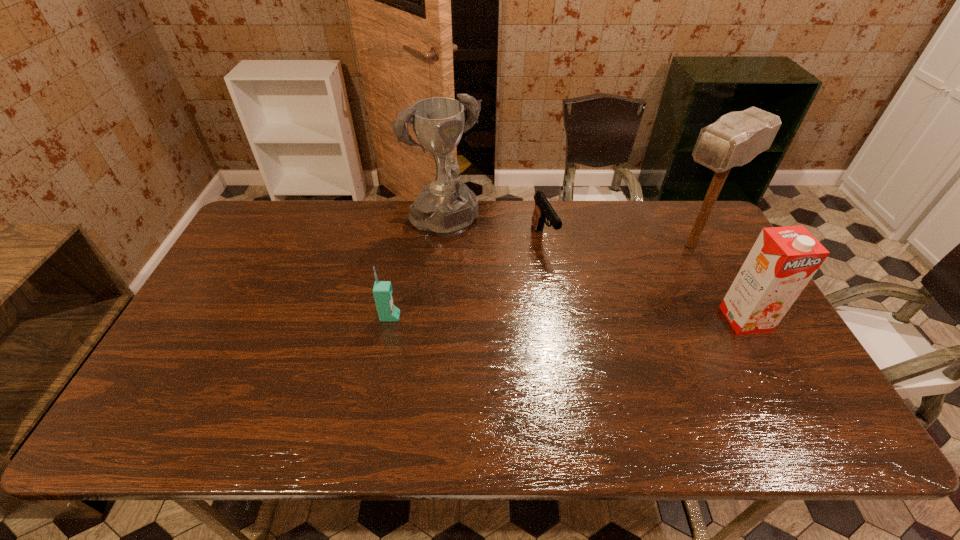
This screenshot has height=540, width=960. Identify the location of vacant space situated 0.150m above the head of the mallet. (635, 276).

The image size is (960, 540). Find the location of `free space located at the barrel of the third object from left to right`. free space located at the barrel of the third object from left to right is located at coordinates (564, 282).

Where is `free region located 0.170m at the barrel of the third object from left to right`? free region located 0.170m at the barrel of the third object from left to right is located at coordinates (571, 295).

The image size is (960, 540). Identify the location of free region located 0.380m at the barrel of the third object from left to right. (604, 353).

Locate an element on the screen. The height and width of the screenshot is (540, 960). vacant region located 0.080m on the side with emblem of the award is located at coordinates (474, 267).

This screenshot has height=540, width=960. I want to click on free spot located on the side with emblem of the award, so click(x=523, y=328).

You are a GUI agent. You are given a task and a screenshot of the screen. Output one action in this format:
    pyautogui.click(x=<x>, y=<y>)
    Task: Click on the vacant space situated on the side with emblem of the award
    This screenshot has width=960, height=540.
    Given the screenshot: What is the action you would take?
    pyautogui.click(x=486, y=281)

Identify the location of mallet positioned at the far edge. The width and height of the screenshot is (960, 540). (736, 138).

Locate an element on the screen. This screenshot has height=540, width=960. pistol present at the far edge is located at coordinates (543, 210).

Where is `award that is at the far edge`? award that is at the far edge is located at coordinates (447, 207).